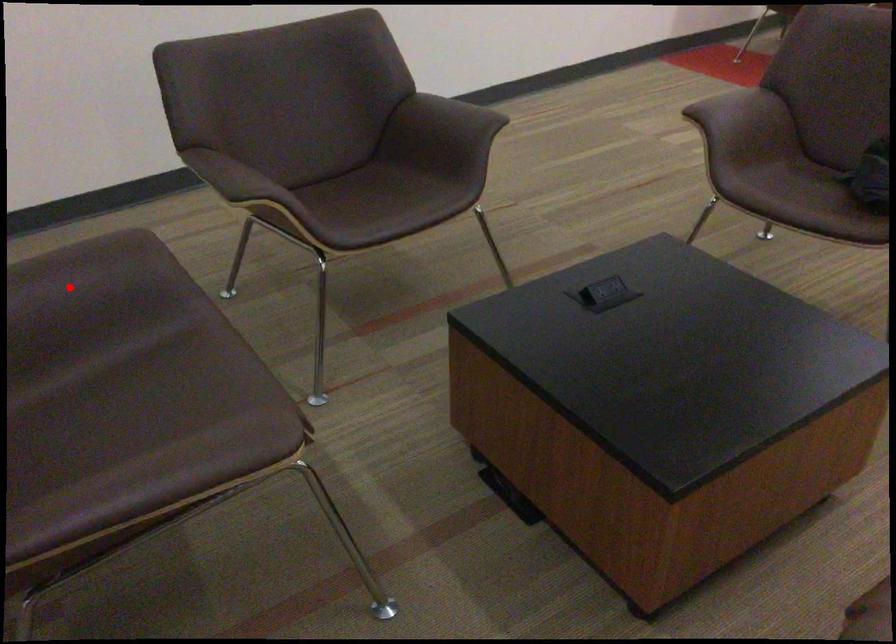
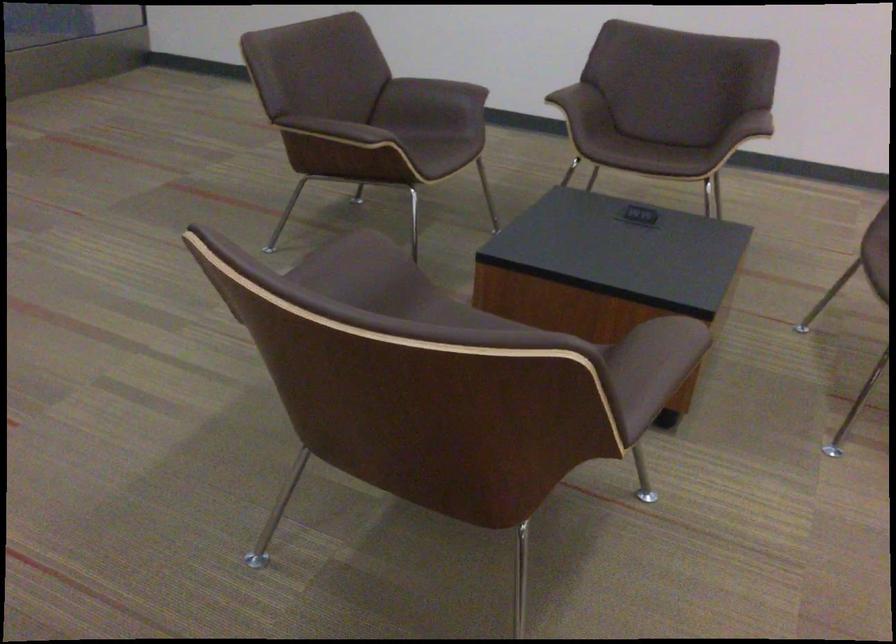
Question: I am providing you with two images of the same scene from different viewpoints. Given a red point in image1, look at the same physical point in image2. Is it:

Choices:
 (A) Closer to the viewpoint
 (B) Farther from the viewpoint

Answer: (B)